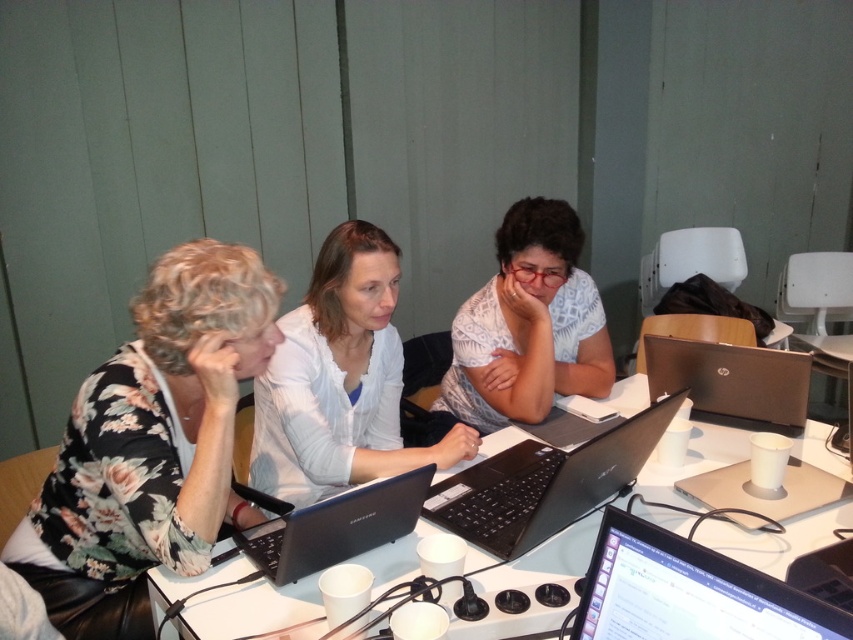
The image size is (853, 640). What do you see at coordinates (247, 609) in the screenshot?
I see `white plastic table at center` at bounding box center [247, 609].

Who is shorter, white plastic table at center or black plastic laptop at center?

black plastic laptop at center is shorter.

Identify the location of white plastic table at center. The width and height of the screenshot is (853, 640). (247, 609).

Between floral fabric blouse at left and black glossy laptop at center, which one has more height?

With more height is floral fabric blouse at left.

Can you confirm if floral fabric blouse at left is bigger than black glossy laptop at center?

Indeed, floral fabric blouse at left has a larger size compared to black glossy laptop at center.

Is point (151, 289) farther from viewer compared to point (254, 550)?

That is False.

Image resolution: width=853 pixels, height=640 pixels. I want to click on floral fabric blouse at left, so click(x=151, y=445).

What do you see at coordinates (688, 593) in the screenshot?
I see `black glossy monitor at lower center` at bounding box center [688, 593].

Image resolution: width=853 pixels, height=640 pixels. What do you see at coordinates (688, 593) in the screenshot?
I see `black glossy monitor at lower center` at bounding box center [688, 593].

The width and height of the screenshot is (853, 640). Identify the location of black glossy monitor at lower center. (688, 593).